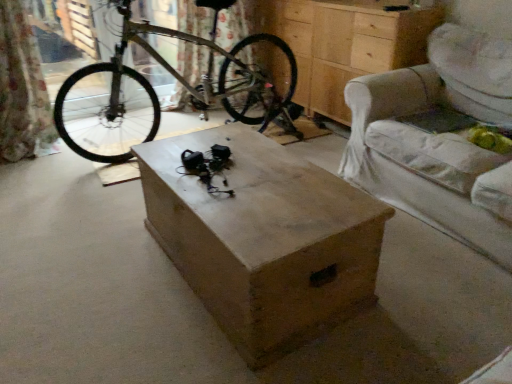
You are a GUI agent. You are given a task and a screenshot of the screen. Output one action in this format:
    pyautogui.click(x=<x>, y=<y>)
    Task: Click on the free location to the left of wooden box at center
    
    Given the screenshot: What is the action you would take?
    pyautogui.click(x=93, y=259)